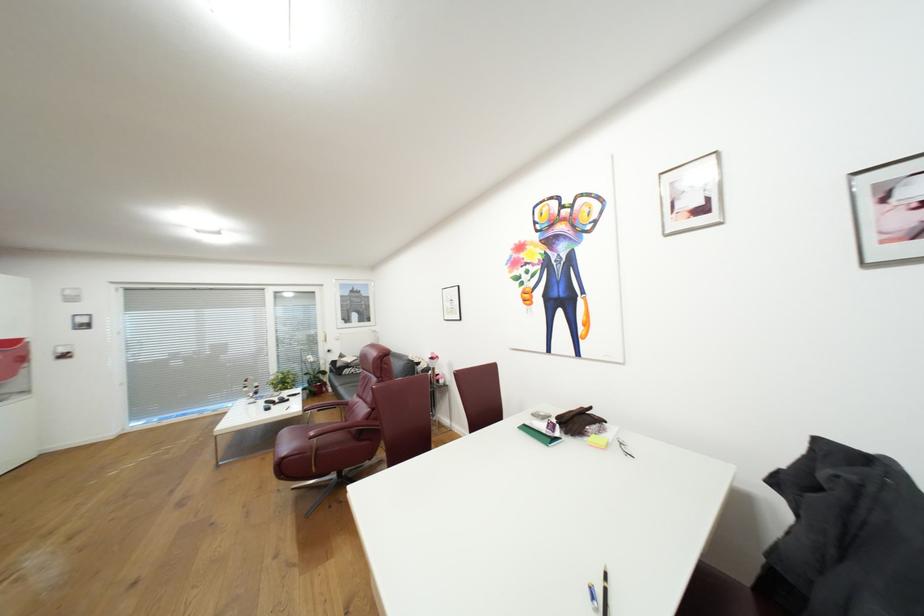
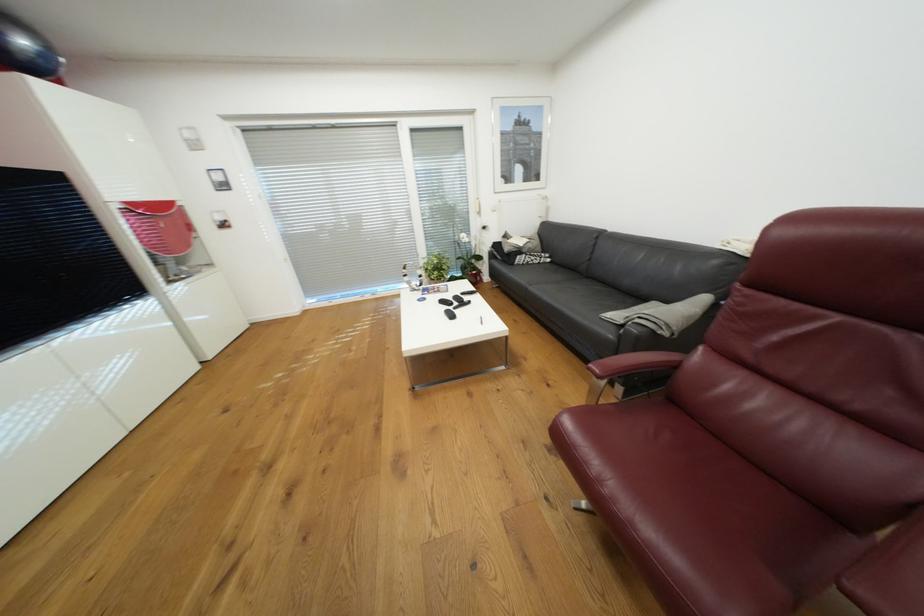
Where in the second image is the point corresponding to point 282,399 from the first image?

(456, 297)